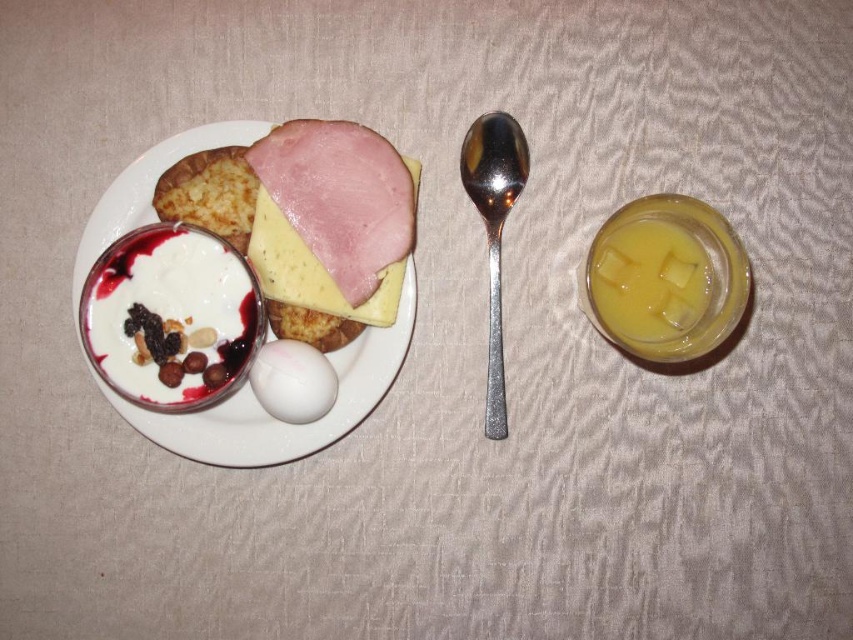
Question: Which object is closer to the camera taking this photo?

Choices:
 (A) white creamy yogurt with nuts and berries at center-left
 (B) translucent yellow liquid at right
 (C) white glossy egg at center

Answer: (B)

Question: Among these points, which one is farthest from the camera?

Choices:
 (A) (518, 164)
 (B) (225, 132)
 (C) (303, 397)
 (D) (144, 310)

Answer: (A)

Question: Is white glossy plate at center positioned behind polished silver spoon at center?

Choices:
 (A) no
 (B) yes

Answer: (A)

Question: Which of the following is the closest to the observer?

Choices:
 (A) (253, 456)
 (B) (300, 352)

Answer: (B)

Question: Is polished silver spoon at center to the right of yellow cheese at center from the viewer's perspective?

Choices:
 (A) yes
 (B) no

Answer: (A)

Question: Does translucent yellow liquid at right have a smaller size compared to white glossy egg at center?

Choices:
 (A) no
 (B) yes

Answer: (A)